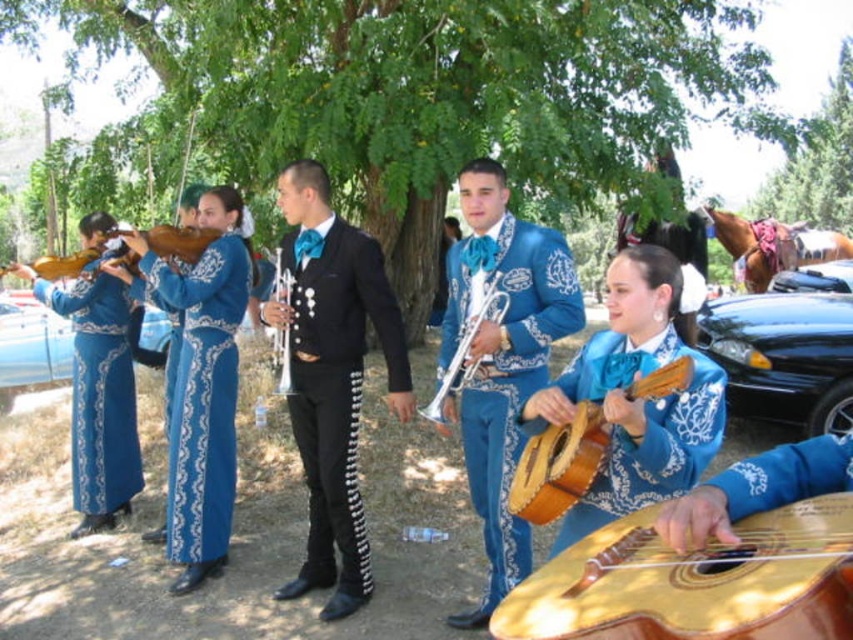
Does green leafy tree at center appear under green leafy tree at upper center?

Yes.

Who is more forward, (517, 182) or (834, 177)?

Point (517, 182) is in front.

Where is `green leafy tree at center`? The width and height of the screenshot is (853, 640). green leafy tree at center is located at coordinates (432, 93).

Does matte blue dress at left have a larger size compared to green leafy tree at upper center?

Incorrect, matte blue dress at left is not larger than green leafy tree at upper center.

Is matte blue dress at left shorter than green leafy tree at upper center?

Indeed, matte blue dress at left has a lesser height compared to green leafy tree at upper center.

Is point (106, 403) positioned after point (846, 38)?

That is False.

Locate an element on the screen. matte blue dress at left is located at coordinates (97, 394).

Is shiny black suit at center shorter than matte blue dress at left?

Incorrect, shiny black suit at center's height does not fall short of matte blue dress at left's.

Between shiny black suit at center and matte blue dress at left, which one is positioned lower?

matte blue dress at left is lower down.

Who is more distant from viewer, (274, 310) or (74, 481)?

Point (74, 481)

You are a GUI agent. You are given a task and a screenshot of the screen. Output one action in this format:
    pyautogui.click(x=<x>, y=<y>)
    Task: Click on the shiny black suit at center
    The width and height of the screenshot is (853, 640).
    Given the screenshot: What is the action you would take?
    pyautogui.click(x=332, y=376)